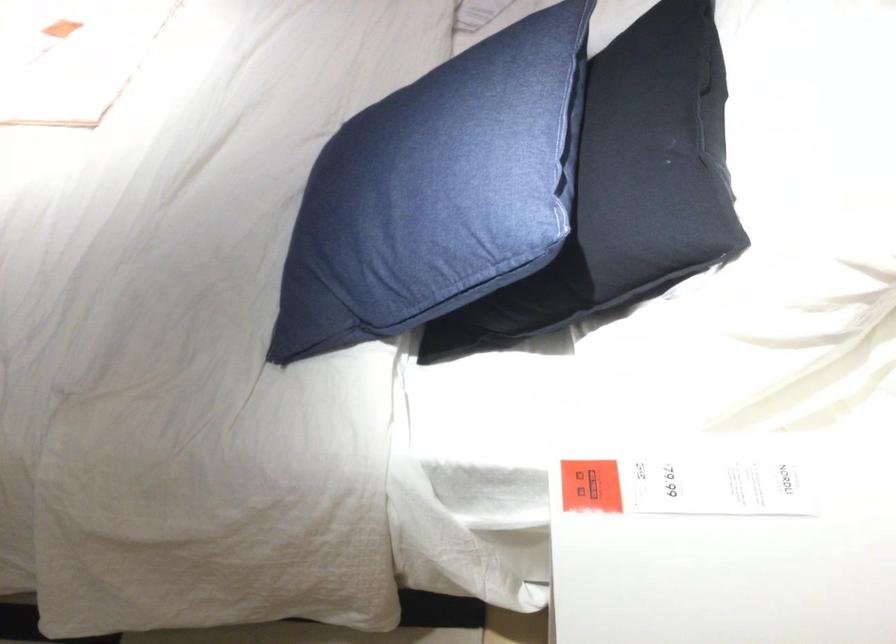
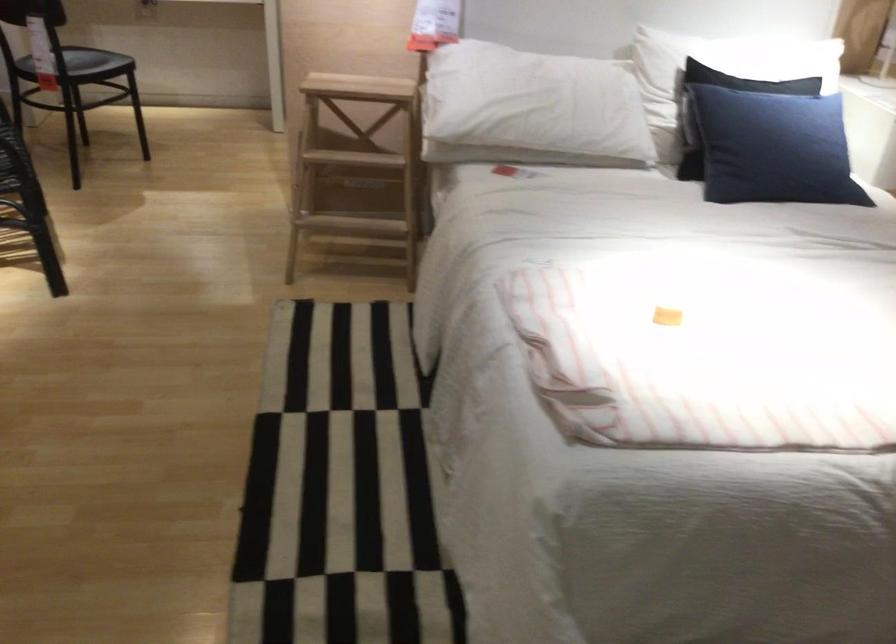
Where in the second image is the point corresponding to point 371,143 from the first image?

(773, 147)